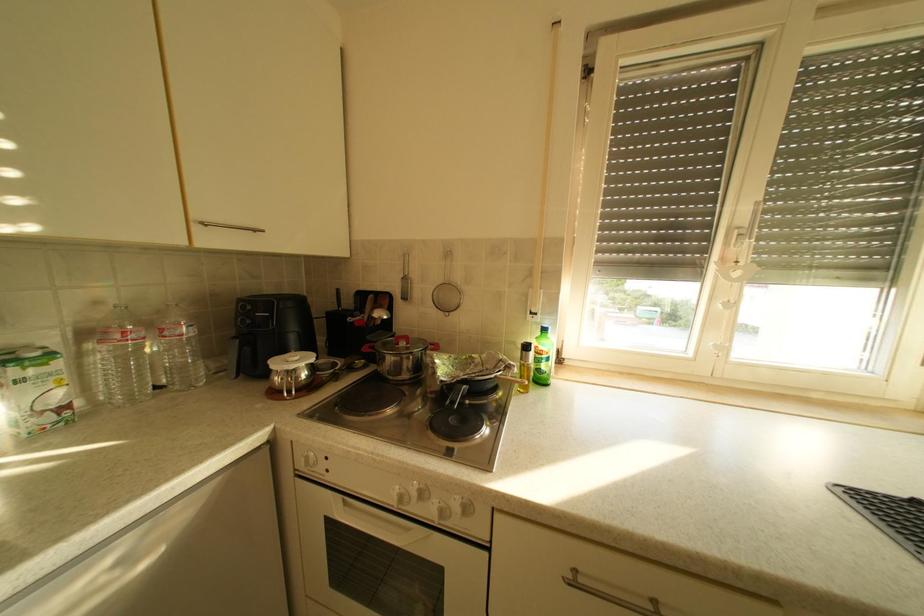
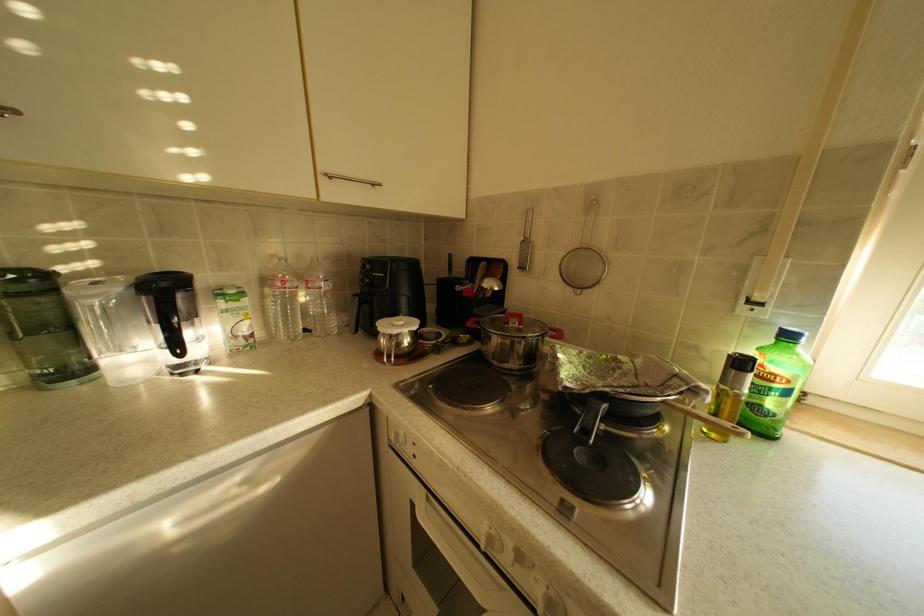
Question: In a continuous first-person perspective shot, in which direction is the camera moving?

Choices:
 (A) Left
 (B) Right
 (C) Forward
 (D) Backward

Answer: (C)